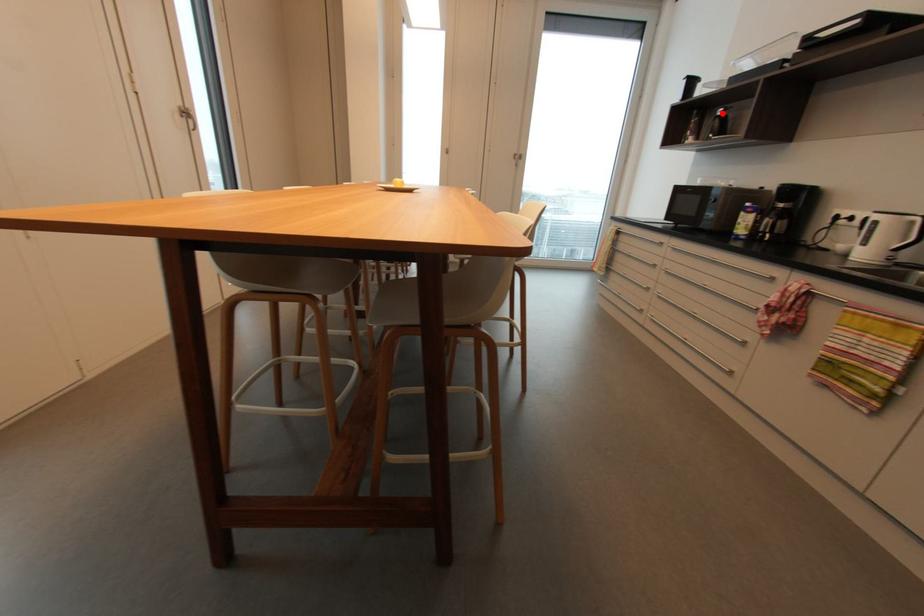
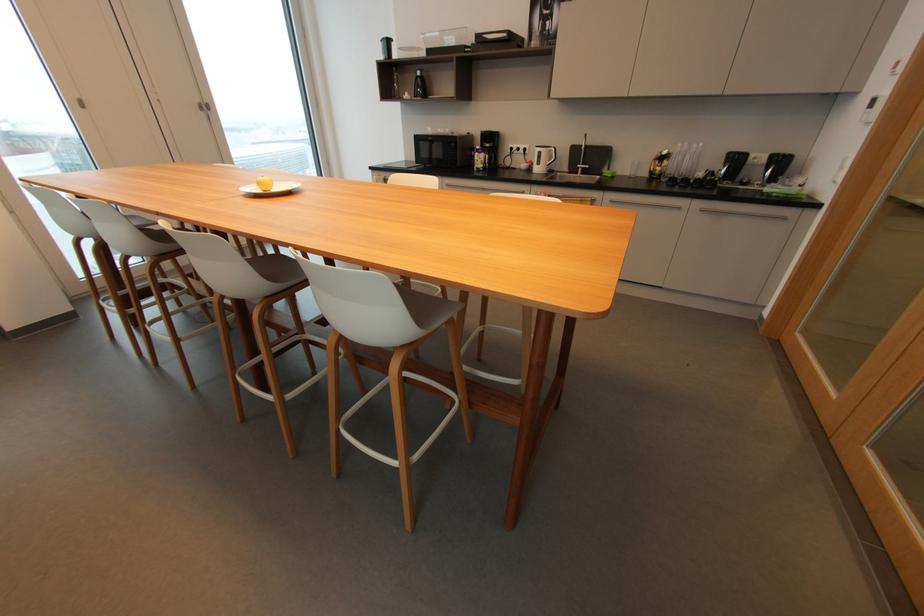
Question: I am providing you with two images of the same scene from different viewpoints. Given a red point in image1, look at the same physical point in image2. Is it:

Choices:
 (A) Closer to the viewpoint
 (B) Farther from the viewpoint

Answer: (A)